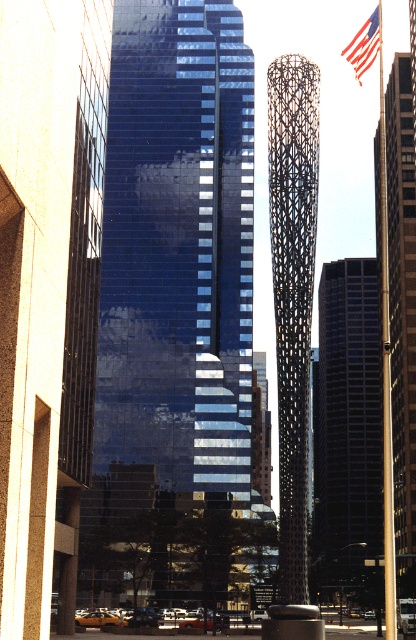
You are a photographer planning to take a photo of the black textured sculpture at center and the american flag at upper right. Which object will appear larger in the photo?

The black textured sculpture at center will appear larger in the photo because it is much taller than the american flag at upper right.

You are standing at the base of the tall, cylindrical sculpture in the cityscape. Looking towards the dark blue glass skyscraper at center, which is marked by point [346,428], can you determine if this point is closer to the top or bottom of the skyscraper?

The point [346,428] marks the dark blue glass skyscraper at center. Since the y coordinate is 0.834, which is closer to 1.0, this point is closer to the top of the skyscraper.

You are an architect analyzing the city layout. You need to determine the spatial relationship between the black textured sculpture at center and the polished glass tower at center. Which one is positioned lower in the scene?

The black textured sculpture at center is located below the polished glass tower at center, so it is positioned lower in the scene.